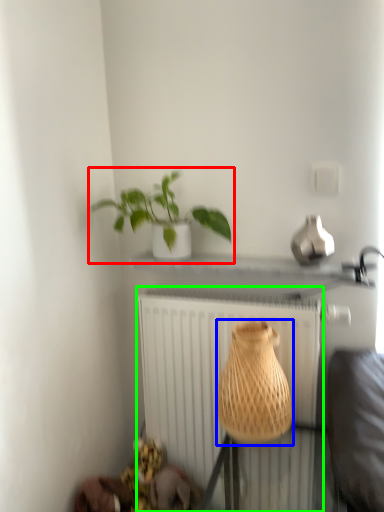
Question: Based on their relative distances, which object is farther from houseplant (highlighted by a red box)? Choose from vase (highlighted by a blue box) and radiator (highlighted by a green box).

Choices:
 (A) vase
 (B) radiator

Answer: (A)